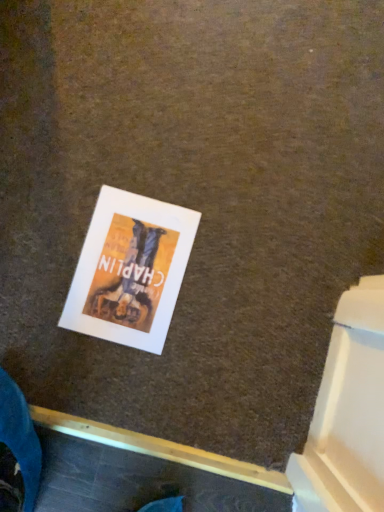
Identify the location of free region on the left part of matte paper poster at center. (38, 248).